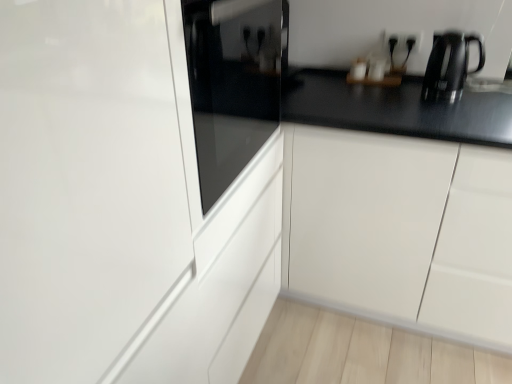
Question: Choose the correct answer: Is glossy white cabinet at center inside black metallic kettle at upper right or outside it?

Choices:
 (A) outside
 (B) inside

Answer: (A)

Question: From their relative heights in the image, would you say glossy white cabinet at center is taller or shorter than black metallic kettle at upper right?

Choices:
 (A) tall
 (B) short

Answer: (A)

Question: Considering the real-world distances, which object is farthest from the black plastic electric outlet at upper right?

Choices:
 (A) black metallic kettle at upper right
 (B) glossy white glass door at center
 (C) glossy white cabinet at center

Answer: (B)

Question: Which of these objects is positioned farthest from the black metallic kettle at upper right?

Choices:
 (A) glossy white cabinet at center
 (B) glossy white glass door at center
 (C) black plastic electric outlet at upper right

Answer: (B)